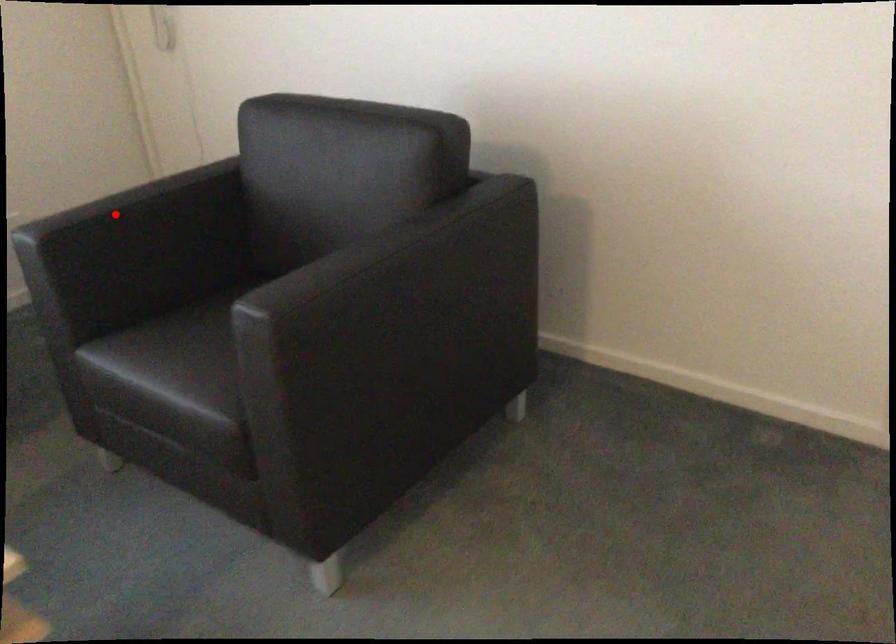
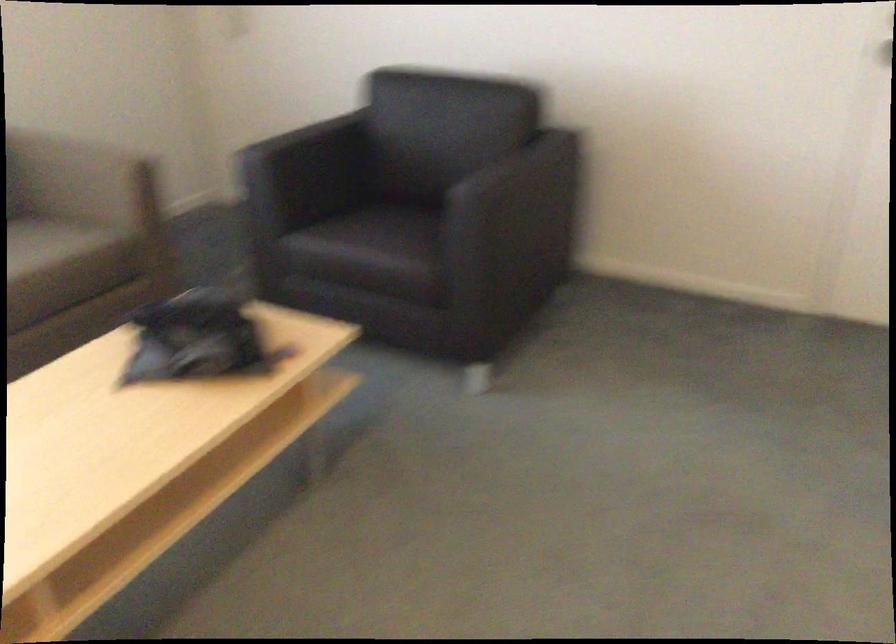
Find the pixel in the second image that matches the highlighted location in the first image.

(304, 138)